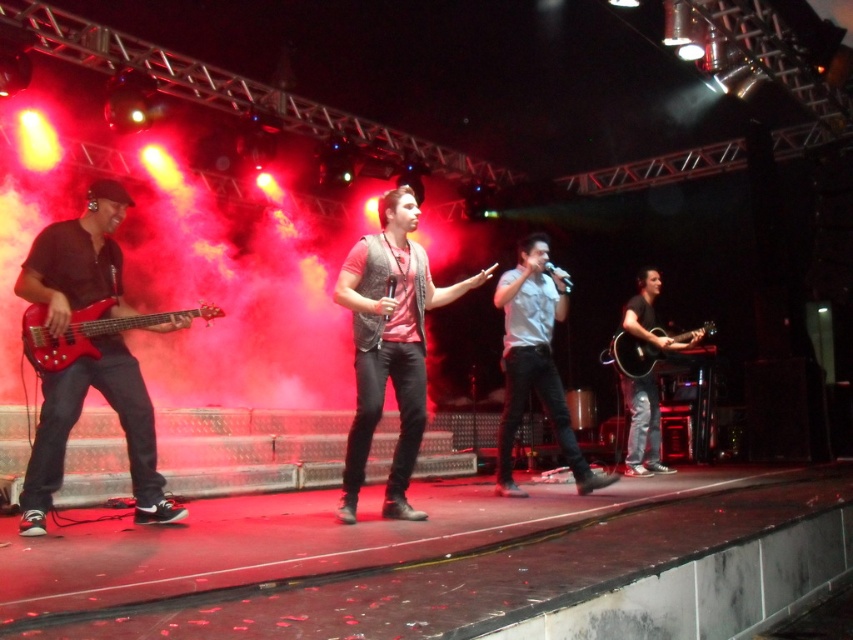
You are a photographer at the back of the venue. You want to take a photo of the denim vest at center without the matte black bass guitar at left blocking it. Is this possible based on their positions?

The matte black bass guitar at left is located above the denim vest at center, so it would block the view. To capture the denim vest at center without obstruction, you would need to adjust your angle or position to avoid the bass guitar.

You are a photographer in the front row of the concert. You want to take a photo of the denim vest at center and the gray matte shirt at center. Which one will appear larger in your photo?

The denim vest at center will appear larger in the photo because it is closer to the viewer than the gray matte shirt at center.